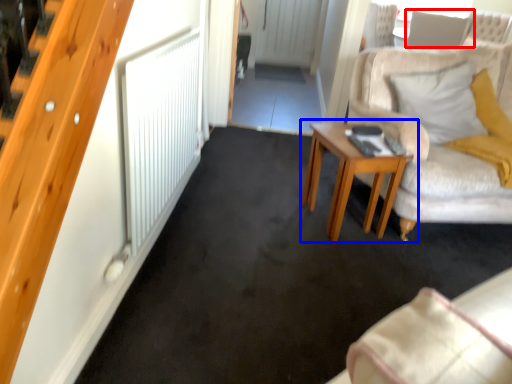
Question: Which object appears closest to the camera in this image, pillow (highlighted by a red box) or table (highlighted by a blue box)?

Choices:
 (A) pillow
 (B) table

Answer: (B)